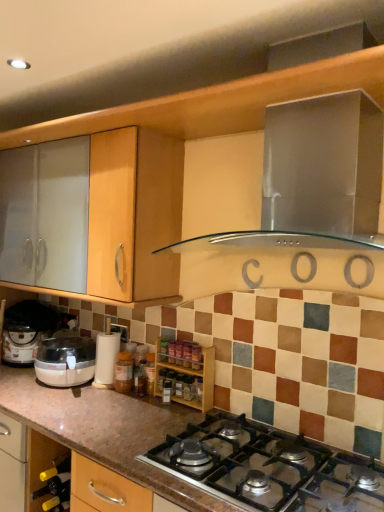
Question: From a real-world perspective, is stainless steel range hood at upper center located higher than metallic silver gas stove at center?

Choices:
 (A) no
 (B) yes

Answer: (B)

Question: Is metallic silver gas stove at center inside stainless steel range hood at upper center?

Choices:
 (A) yes
 (B) no

Answer: (B)

Question: Is stainless steel range hood at upper center not near metallic silver gas stove at center?

Choices:
 (A) no
 (B) yes

Answer: (A)

Question: Is stainless steel range hood at upper center outside of metallic silver gas stove at center?

Choices:
 (A) no
 (B) yes

Answer: (B)

Question: Considering the relative sizes of stainless steel range hood at upper center and metallic silver gas stove at center in the image provided, is stainless steel range hood at upper center bigger than metallic silver gas stove at center?

Choices:
 (A) no
 (B) yes

Answer: (B)

Question: Considering their positions, is translucent plastic bottle at center, which is the 2th bottle from right to left, located in front of or behind green glass wine bottle at lower left?

Choices:
 (A) front
 (B) behind

Answer: (B)

Question: Based on their sizes in the image, would you say translucent plastic bottle at center, the 1th bottle when ordered from back to front, is bigger or smaller than green glass wine bottle at lower left?

Choices:
 (A) small
 (B) big

Answer: (B)

Question: From the image's perspective, is translucent plastic bottle at center, the 1th bottle when ordered from back to front, located above or below green glass wine bottle at lower left?

Choices:
 (A) above
 (B) below

Answer: (A)

Question: Which is correct: translucent plastic bottle at center, the second bottle positioned from the front, is inside green glass wine bottle at lower left, or outside of it?

Choices:
 (A) outside
 (B) inside

Answer: (A)

Question: Considering the positions of metallic silver gas stove at center and wooden spice rack at center in the image, is metallic silver gas stove at center taller or shorter than wooden spice rack at center?

Choices:
 (A) short
 (B) tall

Answer: (A)

Question: Looking at their shapes, would you say metallic silver gas stove at center is wider or thinner than wooden spice rack at center?

Choices:
 (A) wide
 (B) thin

Answer: (A)

Question: Does point (301, 500) appear closer or farther from the camera than point (180, 369)?

Choices:
 (A) farther
 (B) closer

Answer: (B)

Question: From a real-world perspective, is metallic silver gas stove at center above or below wooden spice rack at center?

Choices:
 (A) above
 (B) below

Answer: (B)

Question: Is point (97, 373) positioned closer to the camera than point (158, 386)?

Choices:
 (A) farther
 (B) closer

Answer: (A)

Question: Is white plastic coffee machine at lower left bigger or smaller than translucent glass spice at center, which is the 1th bottle in right-to-left order?

Choices:
 (A) small
 (B) big

Answer: (B)